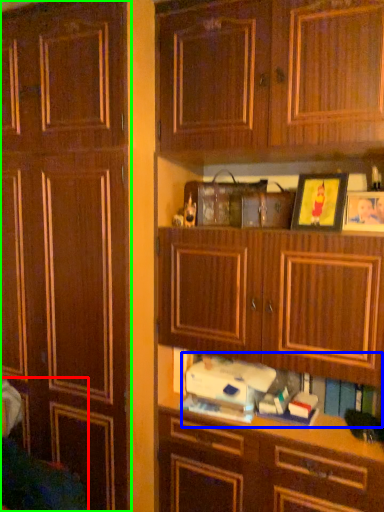
Question: Which is nearer to the swivel chair (highlighted by a red box)? book (highlighted by a blue box) or cabinetry (highlighted by a green box).

Choices:
 (A) book
 (B) cabinetry

Answer: (B)